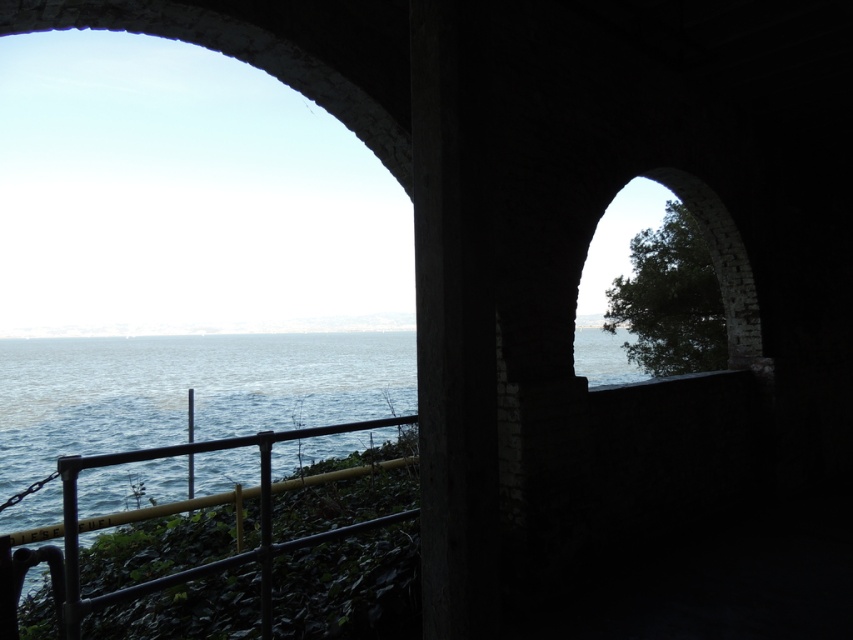
You are standing inside a dark tunnel and see the blue water at center and the black metal railing at lower left. Which object appears taller in the scene?

The blue water at center appears taller than the black metal railing at lower left.

You are standing at the edge of a stone structure overlooking a body of water. You see the blue water at center and the black metal railing at lower left. Which object is positioned lower in the scene?

The blue water at center is positioned lower than the black metal railing at lower left.

You are standing in a shaded area and see the blue water at center and the black metal railing at lower left. Which object takes up more space in the image?

The blue water at center takes up more space in the image because it has a larger size compared to the black metal railing at lower left.